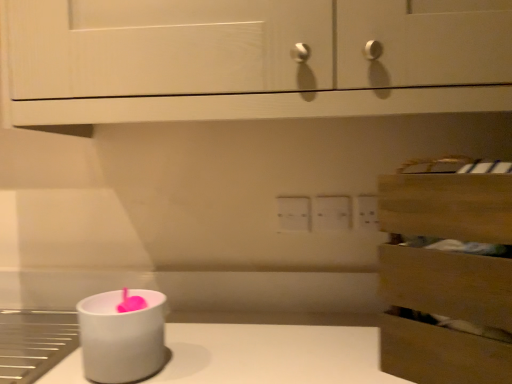
Question: Are white wood cabinet at upper center and wooden drawer at right making contact?

Choices:
 (A) no
 (B) yes

Answer: (A)

Question: Is white wood cabinet at upper center facing away from wooden drawer at right?

Choices:
 (A) yes
 (B) no

Answer: (B)

Question: Does white wood cabinet at upper center lie behind wooden drawer at right?

Choices:
 (A) no
 (B) yes

Answer: (B)

Question: From the image's perspective, is white wood cabinet at upper center on wooden drawer at right?

Choices:
 (A) no
 (B) yes

Answer: (B)

Question: Are white wood cabinet at upper center and wooden drawer at right far apart?

Choices:
 (A) yes
 (B) no

Answer: (B)

Question: Is white matte candle holder at lower left inside the boundaries of white wood cabinet at upper center, or outside?

Choices:
 (A) outside
 (B) inside

Answer: (A)

Question: Relative to white wood cabinet at upper center, is white matte candle holder at lower left in front or behind?

Choices:
 (A) behind
 (B) front

Answer: (A)

Question: In the image, is white matte candle holder at lower left on the left side or the right side of white wood cabinet at upper center?

Choices:
 (A) left
 (B) right

Answer: (A)

Question: From their relative heights in the image, would you say white matte candle holder at lower left is taller or shorter than white wood cabinet at upper center?

Choices:
 (A) tall
 (B) short

Answer: (B)

Question: From the image's perspective, is white wood cabinet at upper center located above or below white matte candle holder at lower left?

Choices:
 (A) above
 (B) below

Answer: (A)

Question: Is white wood cabinet at upper center wider or thinner than white matte candle holder at lower left?

Choices:
 (A) wide
 (B) thin

Answer: (A)

Question: Is point tap(483, 19) positioned closer to the camera than point tap(86, 326)?

Choices:
 (A) closer
 (B) farther

Answer: (B)

Question: Is white wood cabinet at upper center taller or shorter than white matte candle holder at lower left?

Choices:
 (A) tall
 (B) short

Answer: (A)

Question: Based on their sizes in the image, would you say white wood cabinet at upper center is bigger or smaller than white plastic electric outlet at center?

Choices:
 (A) big
 (B) small

Answer: (A)

Question: From a real-world perspective, relative to white plastic electric outlet at center, is white wood cabinet at upper center vertically above or below?

Choices:
 (A) below
 (B) above

Answer: (B)